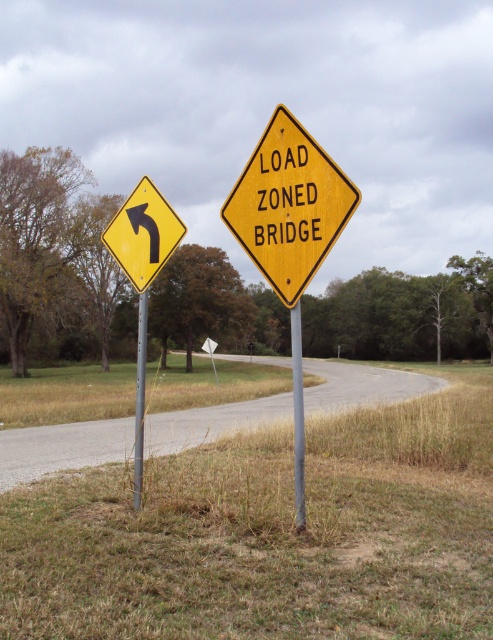
Question: Which point appears closest to the camera in this image?

Choices:
 (A) (295, 445)
 (B) (147, 256)
 (C) (140, 381)
 (D) (340, 170)

Answer: (D)

Question: Can you confirm if yellow matte arrow at left is positioned to the right of metallic gray pole at center?

Choices:
 (A) no
 (B) yes

Answer: (A)

Question: Which point is farther to the camera?

Choices:
 (A) (298, 445)
 (B) (139, 250)
 (C) (281, 248)

Answer: (B)

Question: Can you confirm if metallic gray pole at center is thinner than metallic pole at left?

Choices:
 (A) no
 (B) yes

Answer: (B)

Question: Which point is farther to the camera?

Choices:
 (A) yellow diamond-shaped sign at center
 (B) metallic gray pole at center

Answer: (B)

Question: Can you confirm if yellow diamond-shaped sign at center is thinner than metallic pole at left?

Choices:
 (A) yes
 (B) no

Answer: (A)